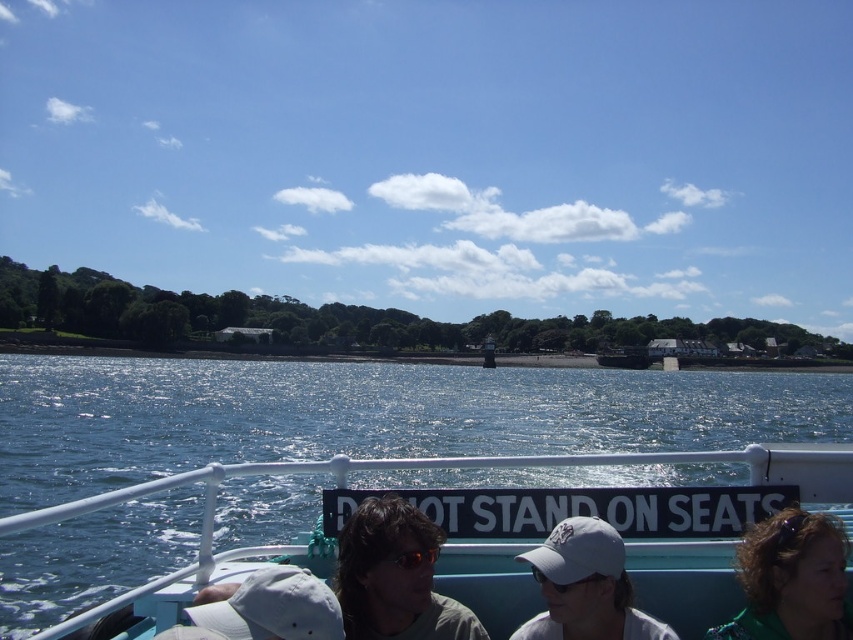
Between matte gray sunglasses at center and white matte baseball cap at lower center, which one appears on the left side from the viewer's perspective?

Positioned to the left is white matte baseball cap at lower center.

Locate an element on the screen. The image size is (853, 640). matte gray sunglasses at center is located at coordinates (395, 577).

Find the location of `matte gray sunglasses at center`. matte gray sunglasses at center is located at coordinates (395, 577).

Between matte gray sunglasses at center and green fabric jacket at lower right, which one is positioned lower?

green fabric jacket at lower right

The image size is (853, 640). Describe the element at coordinates (395, 577) in the screenshot. I see `matte gray sunglasses at center` at that location.

I want to click on matte gray sunglasses at center, so click(395, 577).

Who is lower down, blue plastic boat at center or white matte baseball cap at center?

Positioned lower is blue plastic boat at center.

Measure the distance between point (828, 449) and camera.

5.78 meters

At what (x,y) coordinates should I click in order to perform the action: click on blue plastic boat at center. Please return your answer as a coordinate pair (x, y). This screenshot has height=640, width=853. Looking at the image, I should click on (403, 468).

Locate an element on the screen. The height and width of the screenshot is (640, 853). blue plastic boat at center is located at coordinates (403, 468).